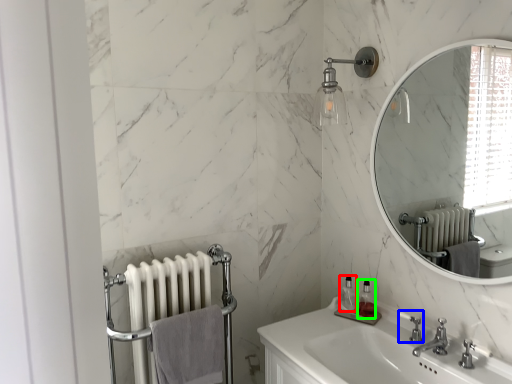
Question: Based on their relative distances, which object is nearer to soap dispenser (highlighted by a red box)? Choose from plumbing fixture (highlighted by a blue box) and soap dispenser (highlighted by a green box).

Choices:
 (A) plumbing fixture
 (B) soap dispenser

Answer: (B)